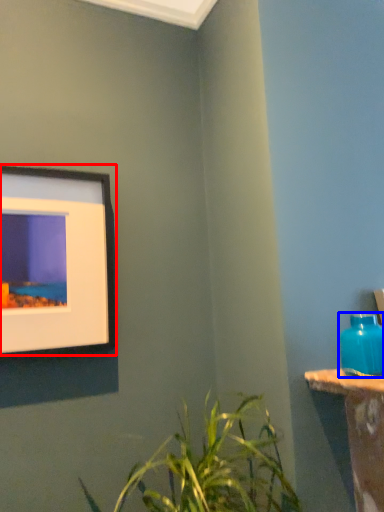
Question: Among these objects, which one is farthest to the camera, picture frame (highlighted by a red box) or bottle (highlighted by a blue box)?

Choices:
 (A) picture frame
 (B) bottle

Answer: (A)